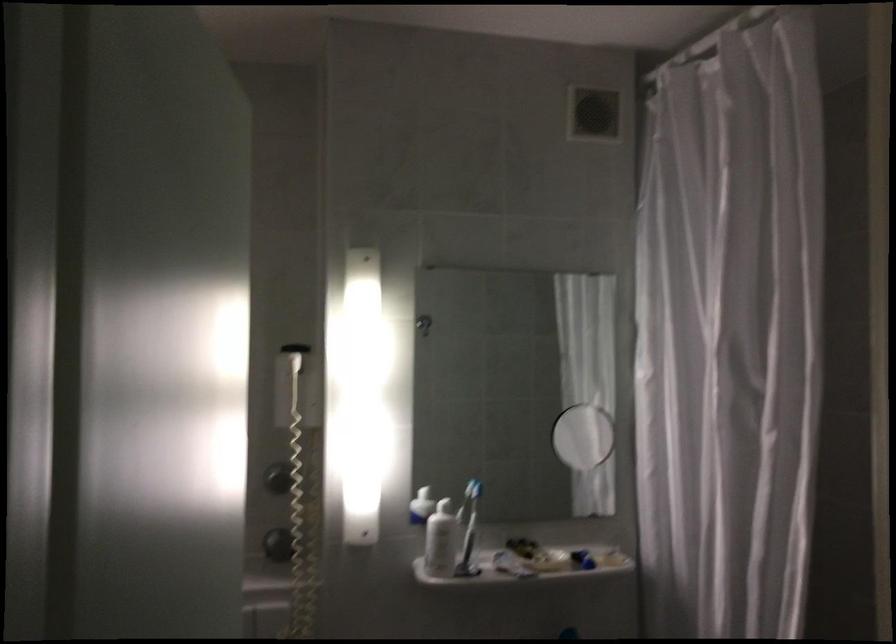
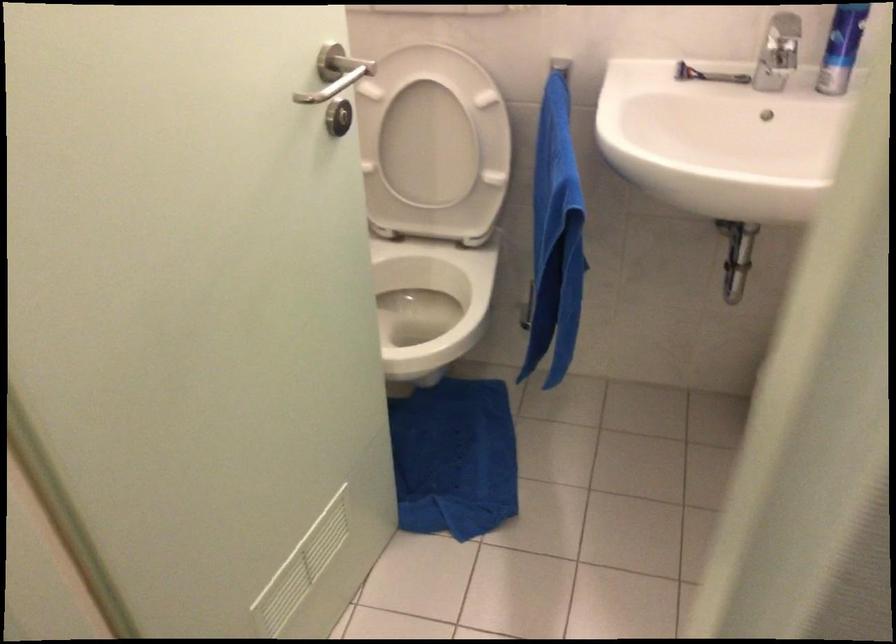
The images are taken continuously from a first-person perspective. In which direction is your viewpoint rotating?

The camera's rotation is toward left-down.